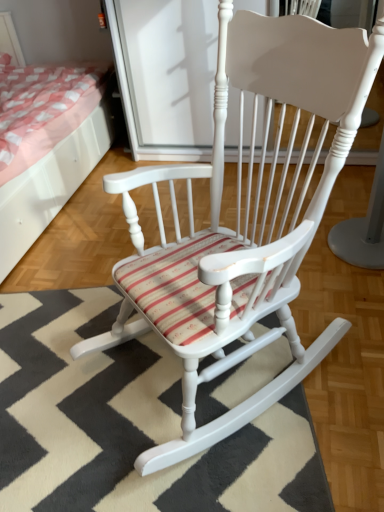
This screenshot has height=512, width=384. In order to click on free space above striped fabric doormat at center (from a real-world perspective) in this screenshot , I will do `click(106, 392)`.